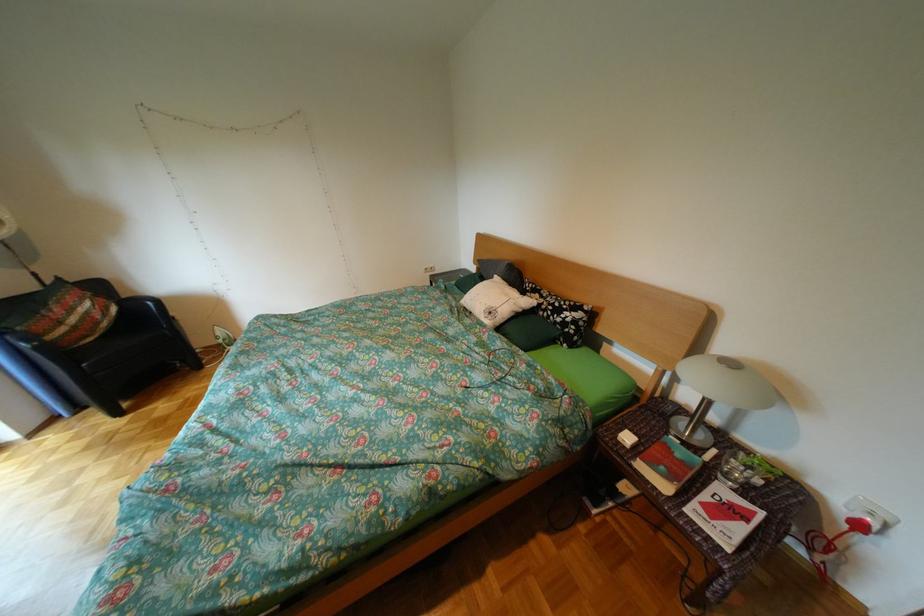
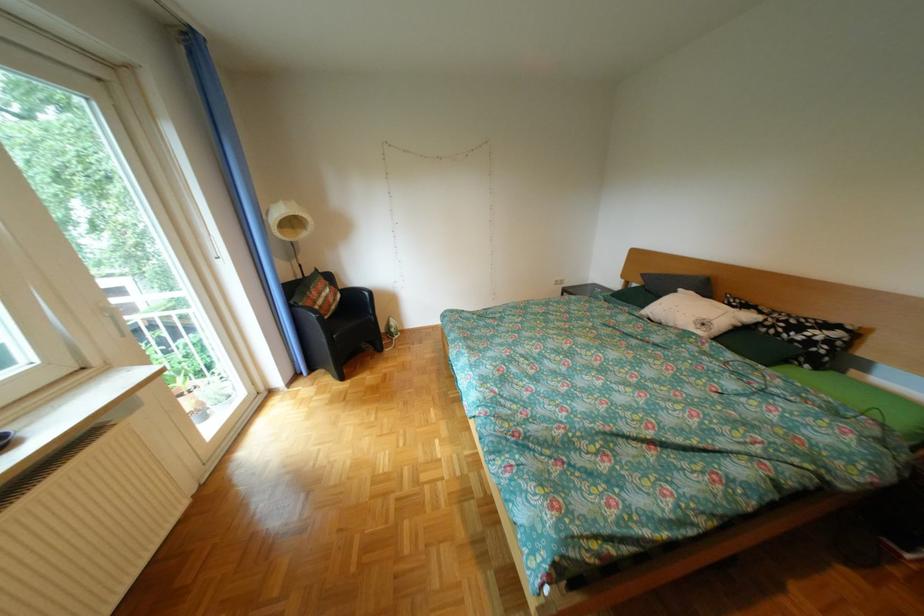
Locate, in the second image, the point that corresponds to point (62, 347) in the first image.

(334, 320)